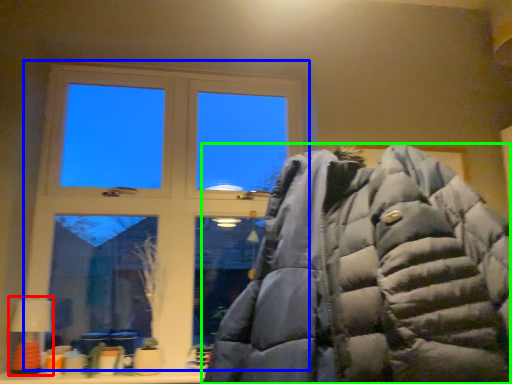
Question: Which object is positioned farthest from table lamp (highlighted by a red box)? Select from window (highlighted by a blue box) and jacket (highlighted by a green box).

Choices:
 (A) window
 (B) jacket

Answer: (B)